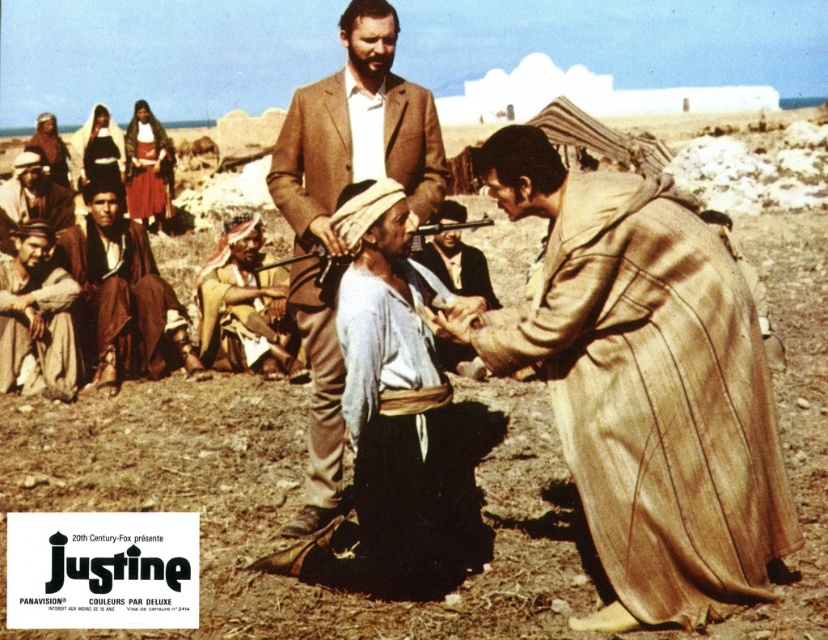
Question: Which point is farther to the camera?

Choices:
 (A) light blue fabric at center
 (B) brown leather hat at lower left
 (C) brown woolen suit at center

Answer: (B)

Question: From the image, what is the correct spatial relationship of beige woolen robe at lower right in relation to brown woven robe at lower left?

Choices:
 (A) above
 (B) below

Answer: (B)

Question: Is beige woolen robe at lower right to the left of smooth leather gun at center from the viewer's perspective?

Choices:
 (A) yes
 (B) no

Answer: (B)

Question: Among these points, which one is nearest to the camera?

Choices:
 (A) (230, 346)
 (B) (51, 212)
 (C) (124, 273)
 (D) (156, 141)

Answer: (A)

Question: Can you confirm if beige woolen robe at lower right is positioned to the right of brown textured robe at upper left?

Choices:
 (A) yes
 (B) no

Answer: (A)

Question: Among these points, which one is farthest from the camera?

Choices:
 (A) (230, 296)
 (B) (118, 272)

Answer: (B)